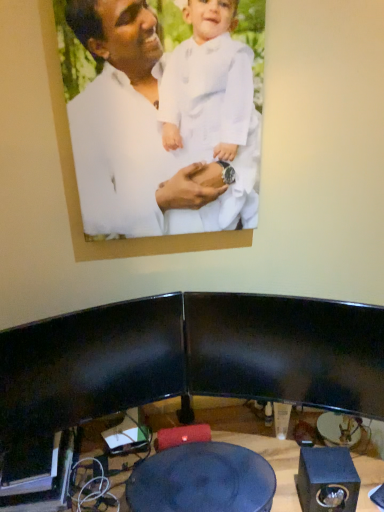
Where is `blank space above blue glossy table at center (from a real-world perspective)`? The width and height of the screenshot is (384, 512). blank space above blue glossy table at center (from a real-world perspective) is located at coordinates pos(195,482).